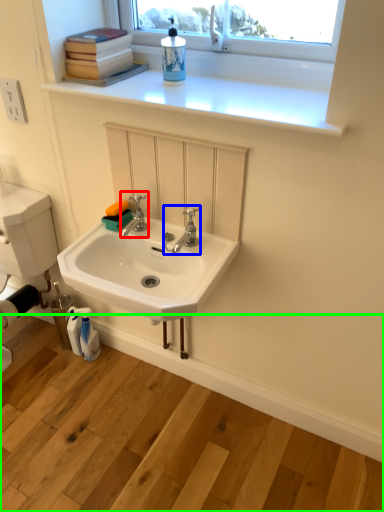
Question: Considering the real-world distances, which object is closest to tap (highlighted by a red box)? tap (highlighted by a blue box) or counter (highlighted by a green box).

Choices:
 (A) tap
 (B) counter

Answer: (A)